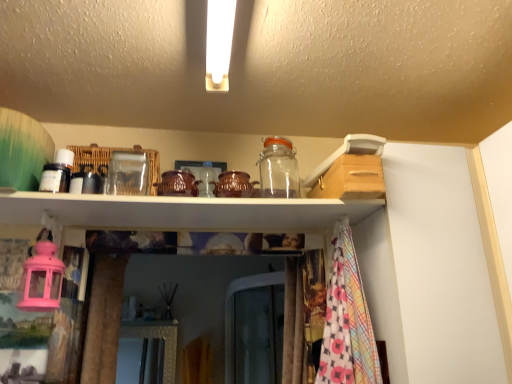
Question: Considering their positions, is transparent glass jar at upper center located in front of or behind white glossy shelf at upper center?

Choices:
 (A) behind
 (B) front

Answer: (A)

Question: Considering the positions of transparent glass jar at upper center and white glossy shelf at upper center in the image, is transparent glass jar at upper center bigger or smaller than white glossy shelf at upper center?

Choices:
 (A) small
 (B) big

Answer: (A)

Question: From a real-world perspective, is transparent glass jar at upper center above or below white glossy shelf at upper center?

Choices:
 (A) above
 (B) below

Answer: (A)

Question: From the image's perspective, is white glossy shelf at upper center positioned above or below transparent glass jar at upper center?

Choices:
 (A) below
 (B) above

Answer: (A)

Question: Is white glossy shelf at upper center spatially inside transparent glass jar at upper center, or outside of it?

Choices:
 (A) outside
 (B) inside

Answer: (A)

Question: Based on their positions, is white glossy shelf at upper center located to the left or right of transparent glass jar at upper center?

Choices:
 (A) left
 (B) right

Answer: (A)

Question: Is point (216, 226) positioned closer to the camera than point (287, 144)?

Choices:
 (A) closer
 (B) farther

Answer: (A)